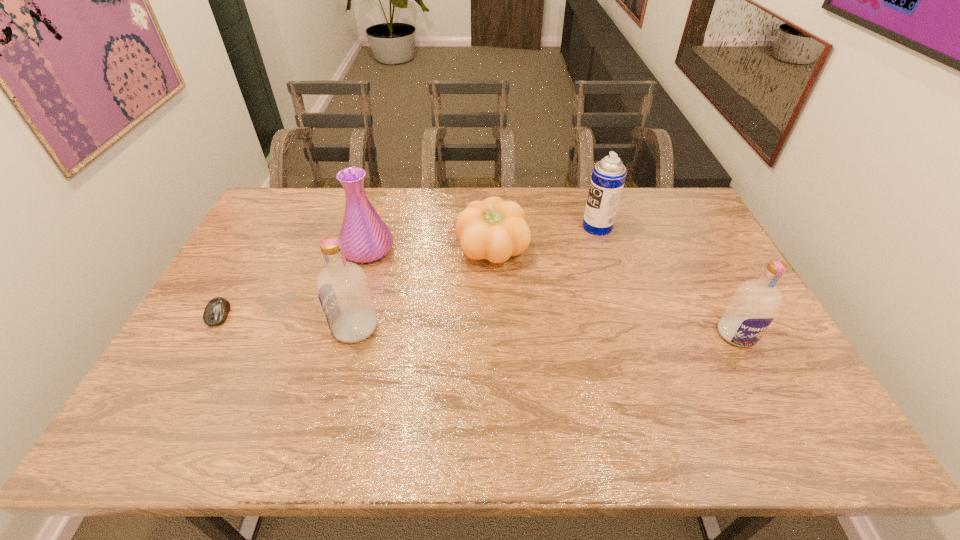
The height and width of the screenshot is (540, 960). What are the coordinates of `the left vodka` in the screenshot? It's located at (343, 291).

This screenshot has width=960, height=540. I want to click on the right vodka, so click(752, 308).

This screenshot has width=960, height=540. I want to click on the rightmost object, so click(752, 308).

The height and width of the screenshot is (540, 960). Identify the location of the fifth object from left to right. pos(608,176).

Image resolution: width=960 pixels, height=540 pixels. I want to click on vase, so click(365, 237).

The height and width of the screenshot is (540, 960). What are the coordinates of `mouse` in the screenshot? It's located at (216, 311).

Find the location of a particular element. the leftmost object is located at coordinates (216, 311).

At what (x,y) coordinates should I click in order to perform the action: click on the fourth object from left to right. Please return your answer as a coordinate pair (x, y). Looking at the image, I should click on (493, 229).

Where is `the second shortest object`? the second shortest object is located at coordinates (493, 229).

Where is `vacant space located 0.300m on the label of the taller vodka`? vacant space located 0.300m on the label of the taller vodka is located at coordinates (222, 328).